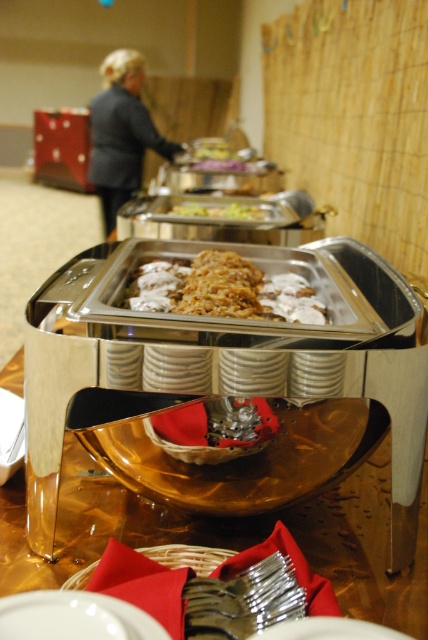
Is point (225, 614) positioned before point (157, 634)?

No, (225, 614) is behind (157, 634).

Who is positioned more to the left, polished metal forks at lower center or white ceramic plate at lower left?

white ceramic plate at lower left is more to the left.

I want to click on polished metal forks at lower center, so click(x=243, y=600).

Between slightly browned matte/soft rice at center and dark blue jacket at upper left, which one appears on the left side from the viewer's perspective?

dark blue jacket at upper left is more to the left.

Who is higher up, slightly browned matte/soft rice at center or dark blue jacket at upper left?

dark blue jacket at upper left is above.

This screenshot has width=428, height=640. In order to click on slightly browned matte/soft rice at center in this screenshot , I will do `click(225, 291)`.

The width and height of the screenshot is (428, 640). What are the coordinates of `slightly browned matte/soft rice at center` in the screenshot? It's located at (225, 291).

Is point (107, 60) positioned in front of point (178, 205)?

No, it is behind (178, 205).

Is dark blue jacket at upper left bigger than green leafy vegetables at center?

Yes, dark blue jacket at upper left is bigger than green leafy vegetables at center.

Identify the location of dark blue jacket at upper left. (121, 132).